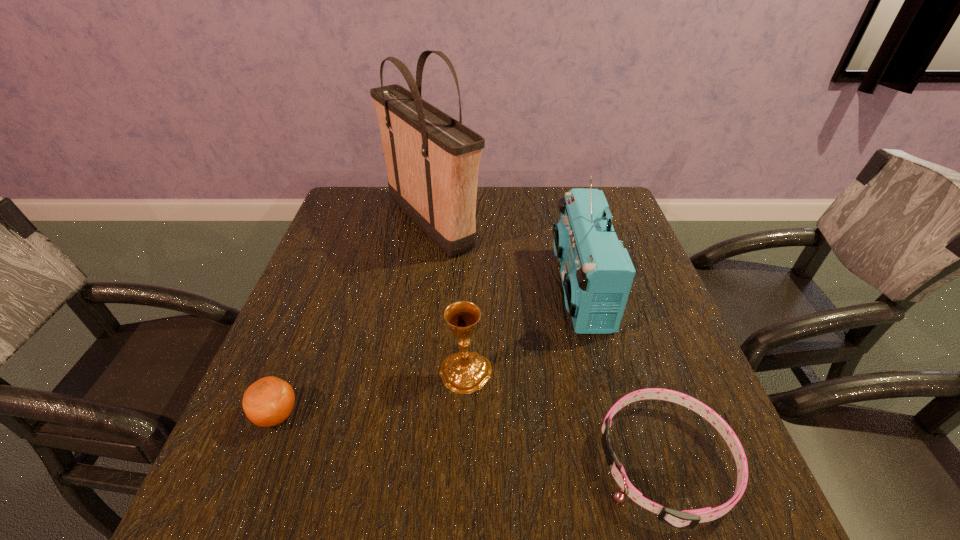
The width and height of the screenshot is (960, 540). In order to click on the tallest object in this screenshot , I will do `click(432, 160)`.

I want to click on radio receiver, so click(597, 273).

Where is `chalice`? chalice is located at coordinates (464, 372).

Locate an element on the screen. The width and height of the screenshot is (960, 540). the third tallest object is located at coordinates (464, 372).

The width and height of the screenshot is (960, 540). I want to click on orange, so click(x=269, y=401).

Find the location of a particular element. The height and width of the screenshot is (540, 960). the fourth tallest object is located at coordinates (269, 401).

The height and width of the screenshot is (540, 960). Identify the location of the shortest object. (687, 519).

This screenshot has width=960, height=540. Find the location of `free space located on the right of the shopping bag`. free space located on the right of the shopping bag is located at coordinates (501, 224).

Locate an element on the screen. vacant space situated on the front-facing side of the fourth shortest object is located at coordinates (479, 288).

Locate an element on the screen. free location located 0.160m on the front-facing side of the fourth shortest object is located at coordinates (492, 288).